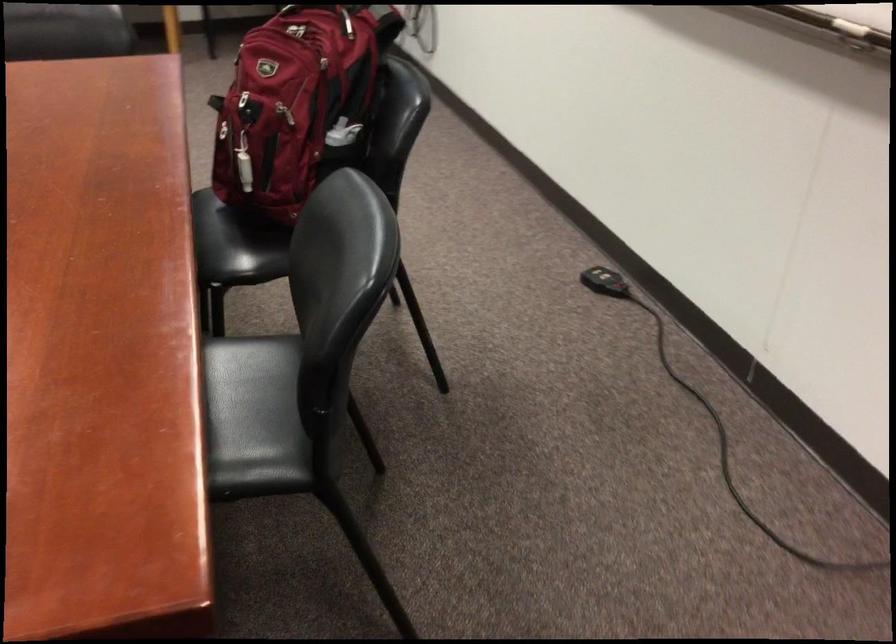
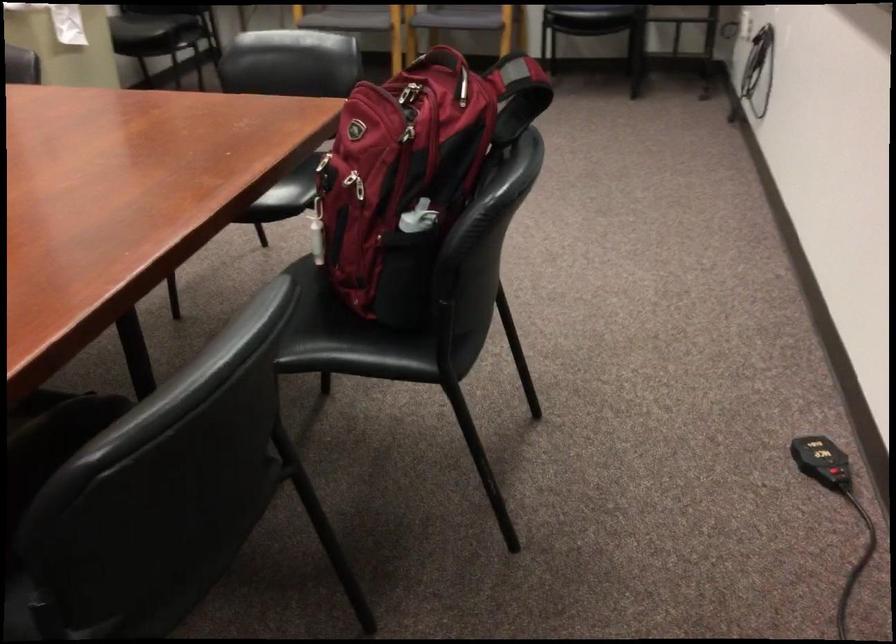
Where in the second image is the point corresponding to (271,117) from the first image?

(355, 184)